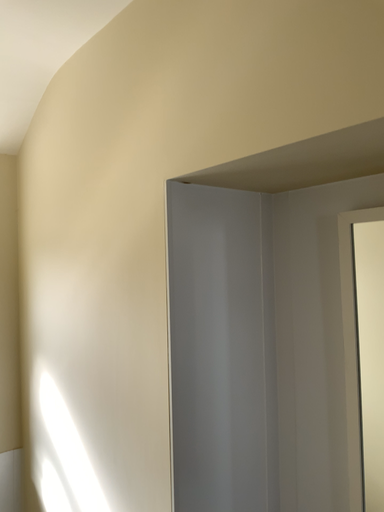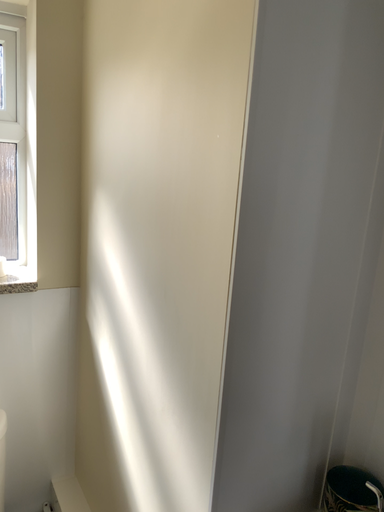
Question: How did the camera likely rotate when shooting the video?

Choices:
 (A) rotated downward
 (B) rotated upward

Answer: (A)